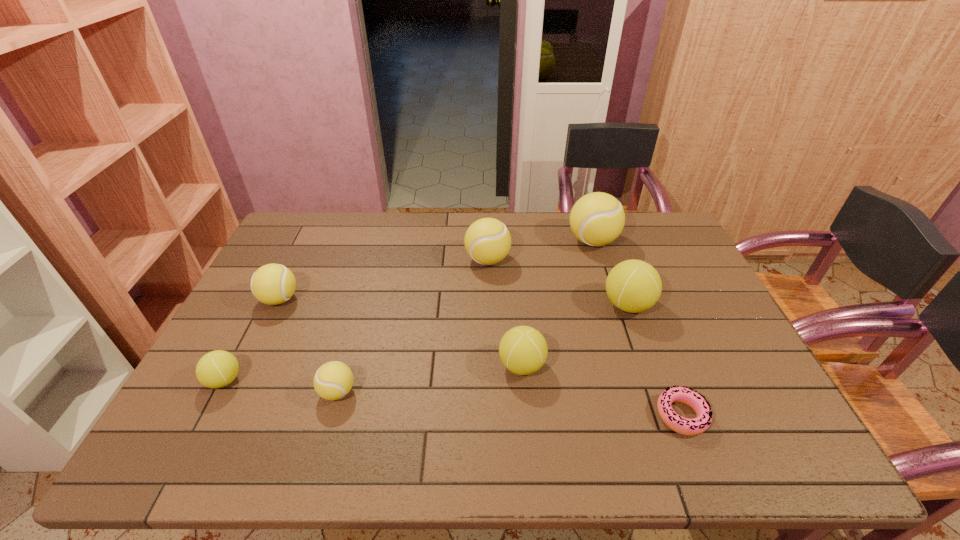
The image size is (960, 540). What are the coordinates of `vacant space located on the back of the doughnut` in the screenshot? It's located at (633, 287).

You are a GUI agent. You are given a task and a screenshot of the screen. Output one action in this format:
    pyautogui.click(x=<x>, y=<y>)
    Task: Click on the object at the near edge
    The width and height of the screenshot is (960, 540).
    Given the screenshot: What is the action you would take?
    pyautogui.click(x=690, y=427)

I want to click on vacant space at the far edge of the desktop, so click(x=425, y=230).

This screenshot has height=540, width=960. In order to click on free space at the near edge of the desktop in this screenshot , I will do `click(315, 436)`.

Identify the location of vacant region at the left edge. (182, 425).

Where is `vacant space at the right edge`? The width and height of the screenshot is (960, 540). vacant space at the right edge is located at coordinates (661, 269).

Identify the location of vacant point located between the third yellow tennis ball from right to left and the rightmost yellow tennis ball. (465, 316).

Locate an element on the screen. Image resolution: width=960 pixels, height=540 pixels. free space between the smallest green tennis ball and the doughnut is located at coordinates pos(453,397).

The width and height of the screenshot is (960, 540). I want to click on empty location between the smallest yellow tennis ball and the leftmost yellow tennis ball, so coord(309,346).

Where is `unoccupied position between the smallest green tennis ball and the farthest green tennis ball`? unoccupied position between the smallest green tennis ball and the farthest green tennis ball is located at coordinates (426, 343).